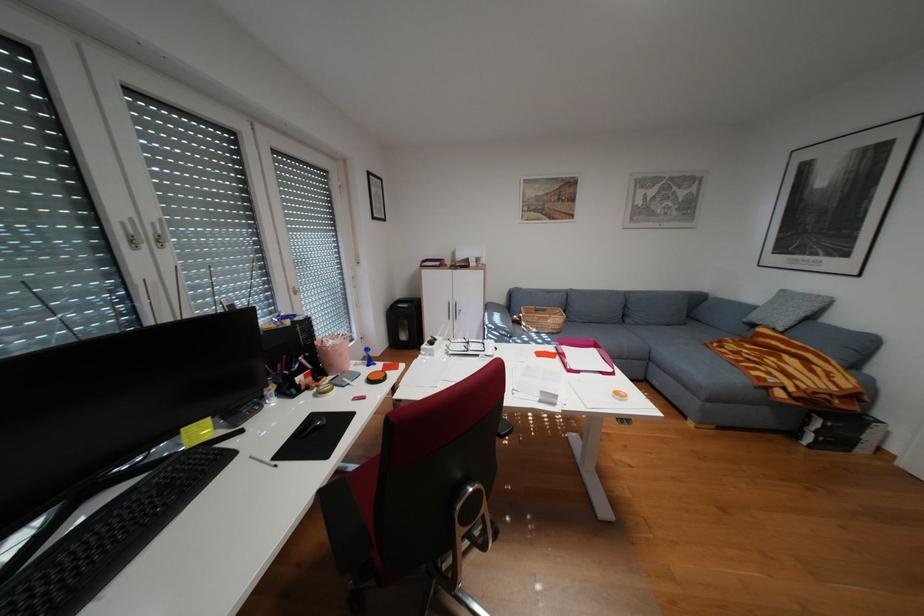
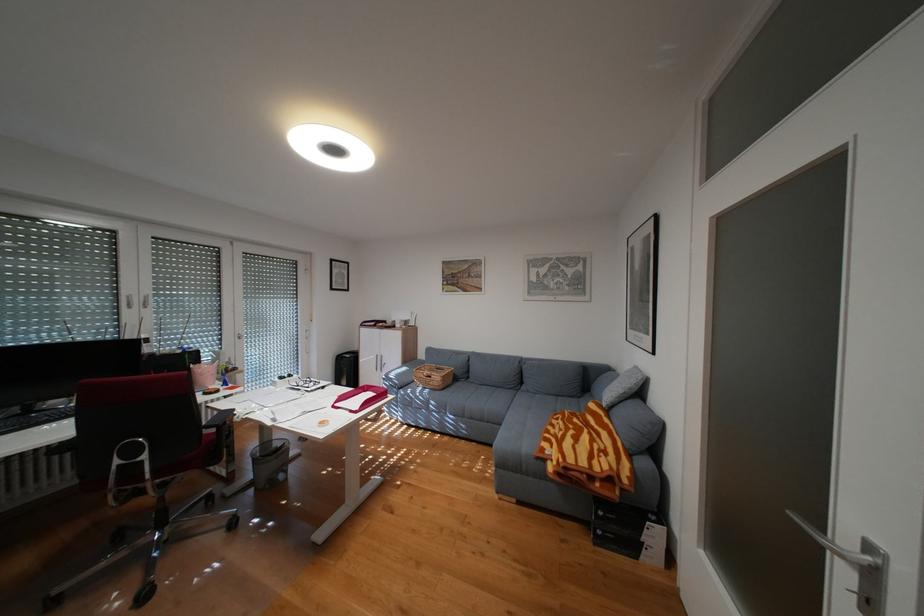
The point at (567, 318) is marked in the first image. Where is the corresponding point in the second image?

(450, 377)